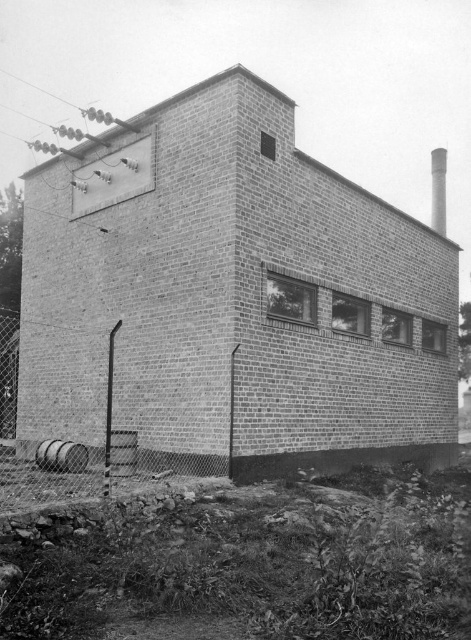
You are standing in front of the building and want to determine the relative positions of two points marked on the structure. Which point is closer to you, point 1 at coordinates (144, 461) or point 2 at coordinates (443, 173)?

Point 1 at coordinates (144, 461) is closer to the viewer than point 2 at coordinates (443, 173).